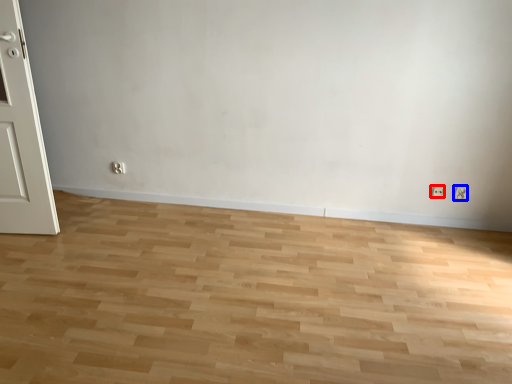
Question: Among these objects, which one is nearest to the camera, electric outlet (highlighted by a red box) or electric outlet (highlighted by a blue box)?

Choices:
 (A) electric outlet
 (B) electric outlet

Answer: (B)